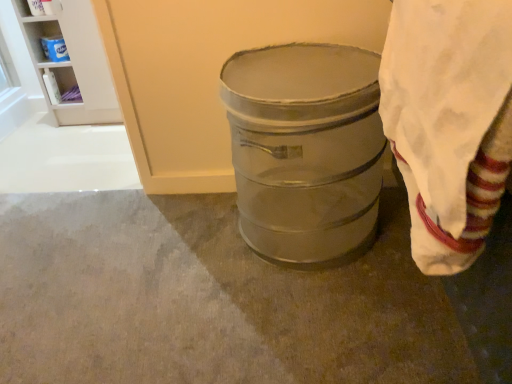
Question: Should I look upward or downward to see white cotton cloth at right?

Choices:
 (A) down
 (B) up

Answer: (B)

Question: Is metallic gray barrel at center bigger than white cotton cloth at right?

Choices:
 (A) yes
 (B) no

Answer: (A)

Question: Can you confirm if metallic gray barrel at center is smaller than white cotton cloth at right?

Choices:
 (A) yes
 (B) no

Answer: (B)

Question: Can we say metallic gray barrel at center lies outside white cotton cloth at right?

Choices:
 (A) no
 (B) yes

Answer: (B)

Question: Does metallic gray barrel at center have a lesser width compared to white cotton cloth at right?

Choices:
 (A) yes
 (B) no

Answer: (B)

Question: From a real-world perspective, is metallic gray barrel at center located beneath white cotton cloth at right?

Choices:
 (A) no
 (B) yes

Answer: (B)

Question: Does metallic gray barrel at center have a lesser height compared to white cotton cloth at right?

Choices:
 (A) no
 (B) yes

Answer: (B)

Question: From a real-world perspective, is white glossy shelf at upper left, positioned as the second shelf in right-to-left order, physically above white plastic shelf at upper left, marked as the second shelf in a left-to-right arrangement?

Choices:
 (A) no
 (B) yes

Answer: (A)

Question: Is the position of white glossy shelf at upper left, which is counted as the first shelf, starting from the left, less distant than that of white plastic shelf at upper left, which is counted as the first shelf, starting from the right?

Choices:
 (A) no
 (B) yes

Answer: (A)

Question: From the image's perspective, is white glossy shelf at upper left, positioned as the second shelf in right-to-left order, on top of white plastic shelf at upper left, which is counted as the first shelf, starting from the right?

Choices:
 (A) no
 (B) yes

Answer: (A)

Question: From a real-world perspective, is white glossy shelf at upper left, which is counted as the first shelf, starting from the left, beneath white plastic shelf at upper left, marked as the second shelf in a left-to-right arrangement?

Choices:
 (A) no
 (B) yes

Answer: (B)

Question: Does white glossy shelf at upper left, which is counted as the first shelf, starting from the left, contain white plastic shelf at upper left, which is counted as the first shelf, starting from the right?

Choices:
 (A) yes
 (B) no

Answer: (B)

Question: Is white glossy shelf at upper left, which is counted as the first shelf, starting from the left, not inside white plastic shelf at upper left, which is counted as the first shelf, starting from the right?

Choices:
 (A) no
 (B) yes

Answer: (A)

Question: Considering the relative sizes of white plastic shelf at upper left, marked as the second shelf in a left-to-right arrangement, and metallic gray trash can at center in the image provided, is white plastic shelf at upper left, marked as the second shelf in a left-to-right arrangement, shorter than metallic gray trash can at center?

Choices:
 (A) no
 (B) yes

Answer: (A)